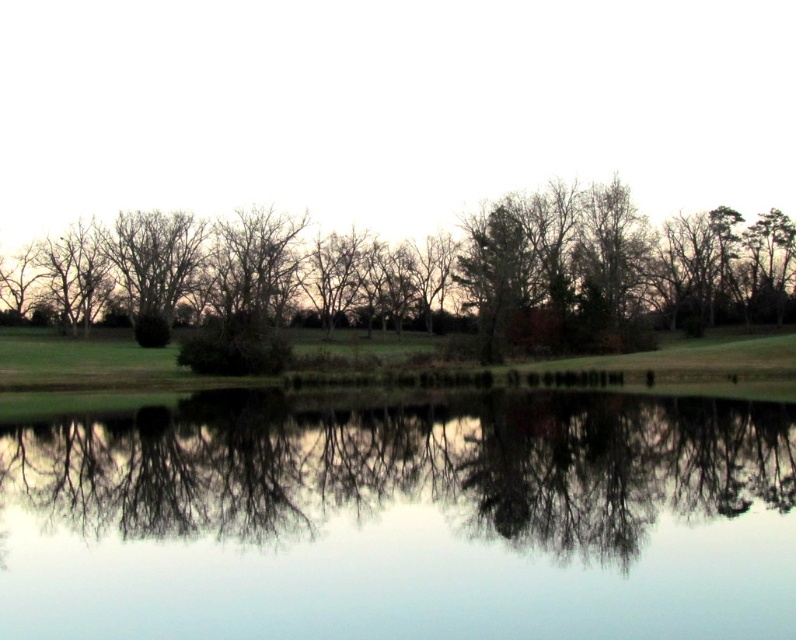
You are standing at the point labeled as point [404,518] in the image. What is the primary substance you are standing on?

The point [404,518] corresponds to transparent water at center, so you are standing on water.

You are an artist planning to paint the scene. You want to ensure the transparent water at center and the green leafy tree at center are proportionally accurate. Which object should you make wider in your painting?

The green leafy tree at center should be made wider since it has a greater width than the transparent water at center according to the description.

You are standing on the bank of the lake and see the transparent water at center and the green leafy tree at center. Which object is located to the right side?

The green leafy tree at center is located to the right side of the transparent water at center.